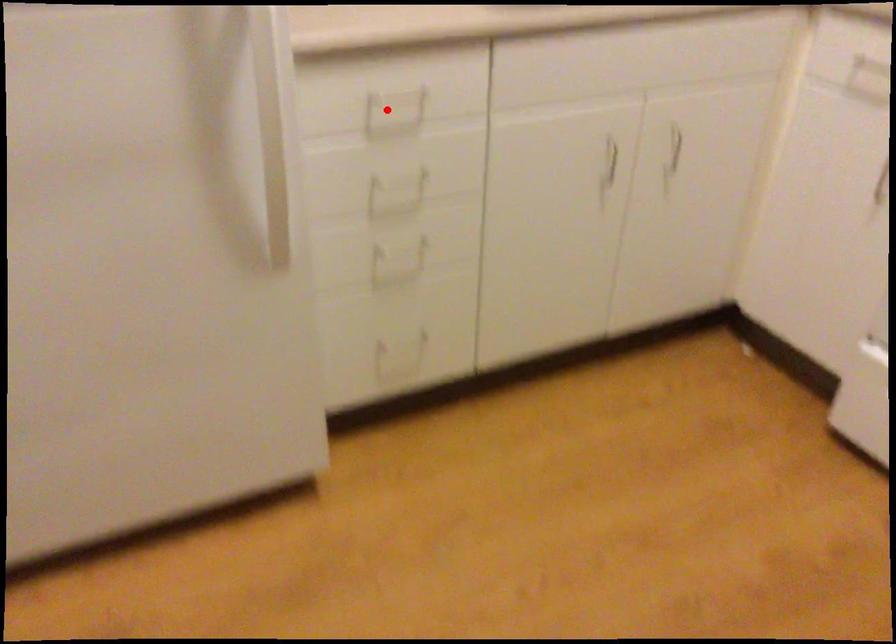
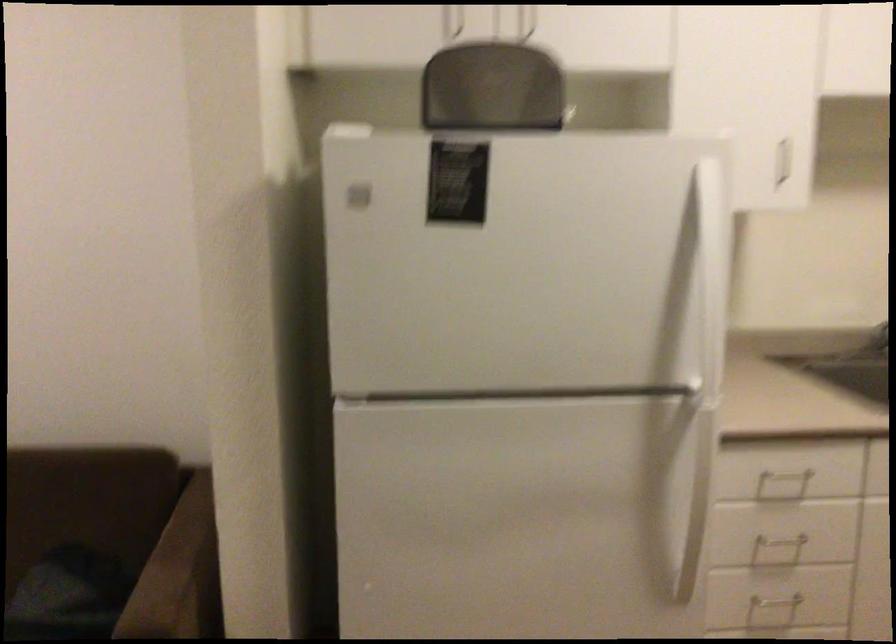
The point at the highlighted location is marked in the first image. Where is the corresponding point in the second image?

(780, 486)